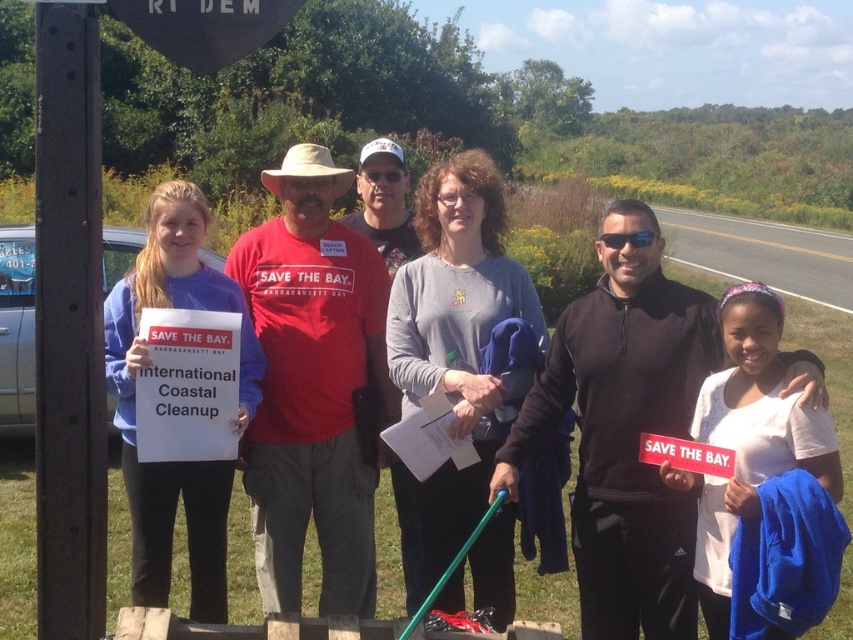
Can you confirm if gray cotton shirt at center is shorter than white paper sign at center?

Correct, gray cotton shirt at center is not as tall as white paper sign at center.

Does gray cotton shirt at center appear on the left side of white paper sign at center?

No, gray cotton shirt at center is not to the left of white paper sign at center.

Image resolution: width=853 pixels, height=640 pixels. Find the location of `gray cotton shirt at center`. gray cotton shirt at center is located at coordinates (454, 348).

Locate an element on the screen. Image resolution: width=853 pixels, height=640 pixels. matte red t-shirt at center is located at coordinates (314, 388).

The width and height of the screenshot is (853, 640). What are the coordinates of `matte red t-shirt at center` in the screenshot? It's located at (314, 388).

I want to click on matte red t-shirt at center, so click(314, 388).

Is matte red t-shirt at center further to the viewer compared to black matte jacket at center?

Yes, it is behind black matte jacket at center.

Does matte red t-shirt at center have a greater width compared to black matte jacket at center?

Result: Yes.

The height and width of the screenshot is (640, 853). What are the coordinates of `matte red t-shirt at center` in the screenshot? It's located at (314, 388).